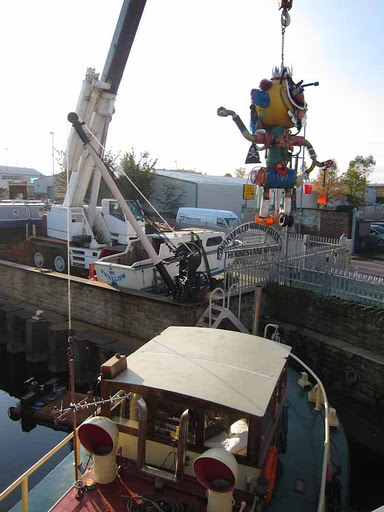
Locate an element on the screen. This screenshot has height=512, width=384. hook is located at coordinates (285, 25).